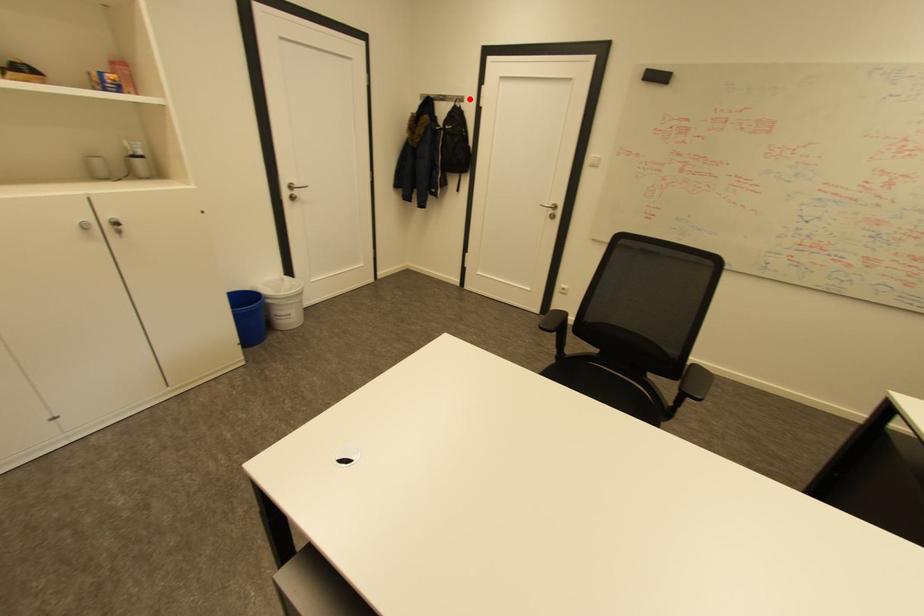
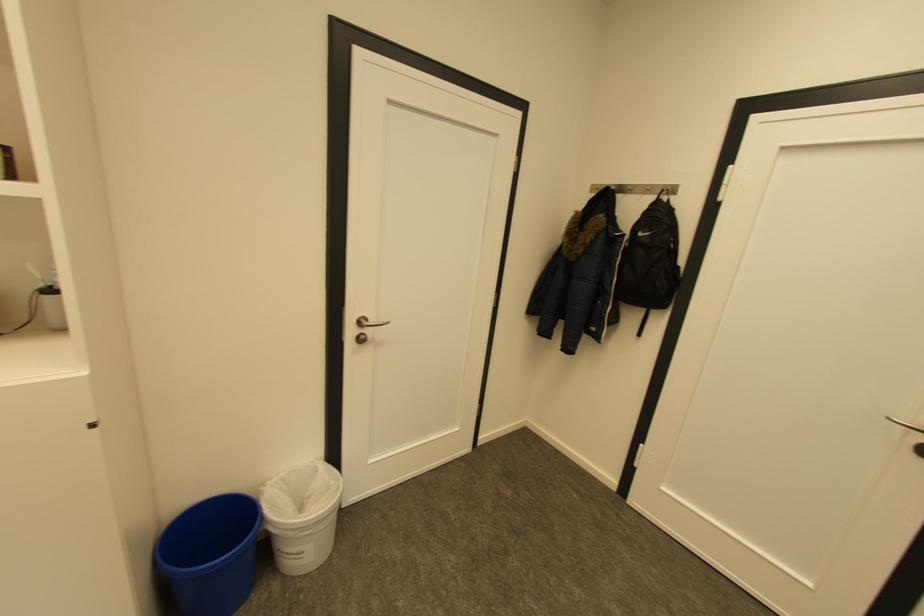
Question: I am providing you with two images of the same scene from different viewpoints. In image1, a red point is highlighted. Considering the same 3D point in image2, which of the following is correct?

Choices:
 (A) It is closer
 (B) It is farther

Answer: (B)